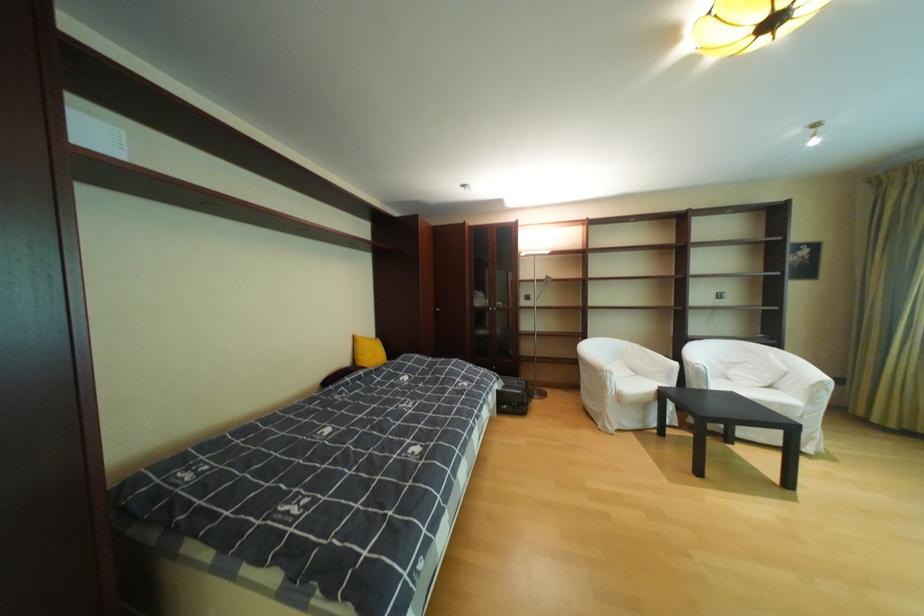
What are the coordinates of `black suitcase` in the screenshot? It's located at (513, 395).